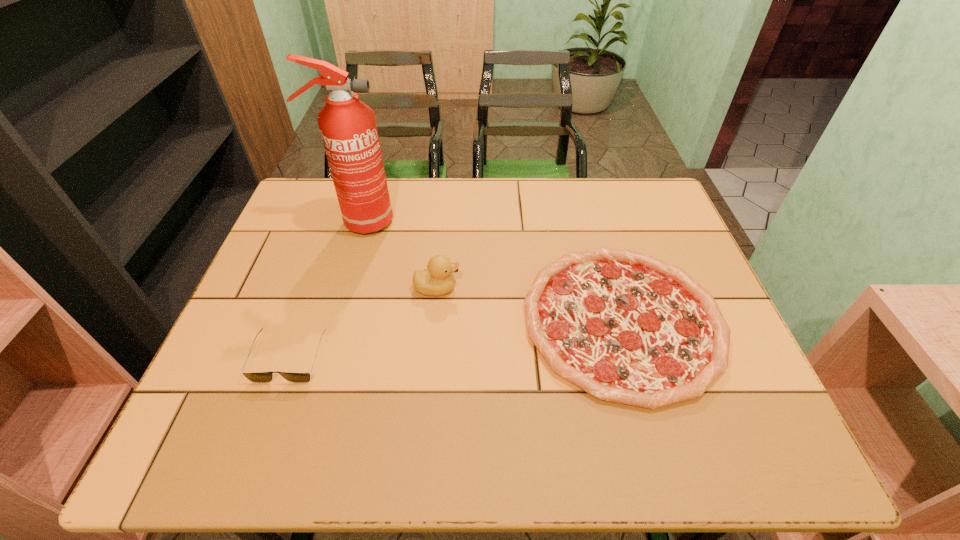
Locate an element on the screen. This screenshot has height=540, width=960. vacant space located on the left of the rightmost object is located at coordinates (462, 320).

Where is `object situated at the far edge`? object situated at the far edge is located at coordinates (348, 128).

Where is `fire extinguisher that is at the left edge`? fire extinguisher that is at the left edge is located at coordinates (348, 128).

This screenshot has height=540, width=960. In order to click on sunglasses located in the left edge section of the desktop in this screenshot , I will do `click(257, 377)`.

Identify the location of object located at the right edge. This screenshot has width=960, height=540. (626, 327).

Where is `object situated at the far left corner`? object situated at the far left corner is located at coordinates (348, 128).

Identify the location of free space at the far edge of the desktop. (595, 218).

The height and width of the screenshot is (540, 960). In the image, there is a desktop. Identify the location of vacant space at the near edge. (329, 429).

Image resolution: width=960 pixels, height=540 pixels. I want to click on vacant space at the left edge, so click(216, 404).

Locate an element on the screen. Image resolution: width=960 pixels, height=540 pixels. vacant region at the far left corner of the desktop is located at coordinates (329, 218).